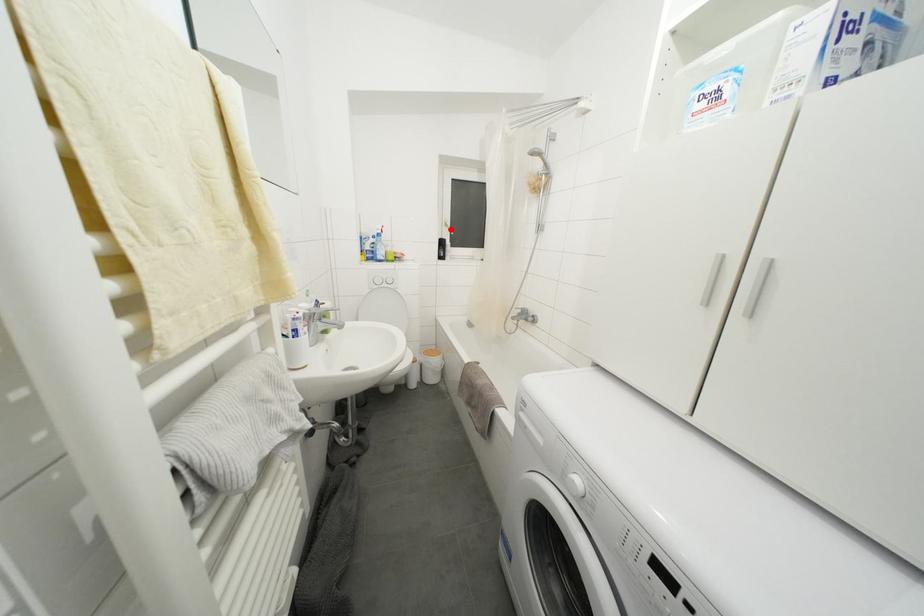
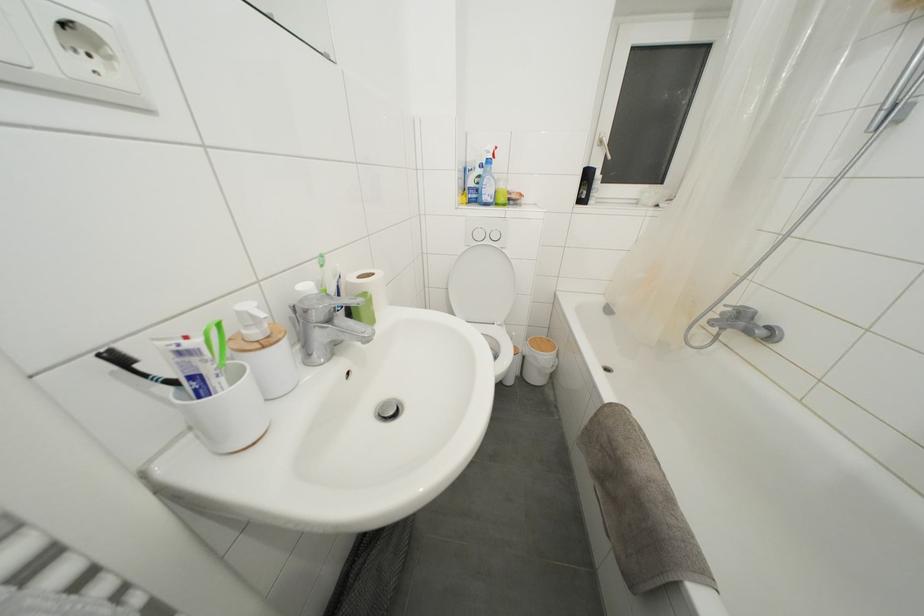
Locate, in the second image, the point that corresponds to the highlighted location in the first image.

(604, 148)